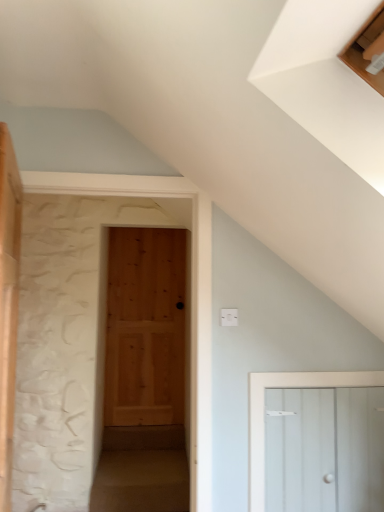
Locate an element on the screen. This screenshot has height=512, width=384. white painted wood door at lower right is located at coordinates (324, 449).

Describe the element at coordinates (324, 449) in the screenshot. The width and height of the screenshot is (384, 512). I see `white painted wood door at lower right` at that location.

You are a GUI agent. You are given a task and a screenshot of the screen. Output one action in this format:
    pyautogui.click(x=<x>, y=<y>)
    Task: Click on the white painted wood door at lower right
    This screenshot has height=512, width=384.
    Given the screenshot: What is the action you would take?
    pyautogui.click(x=324, y=449)